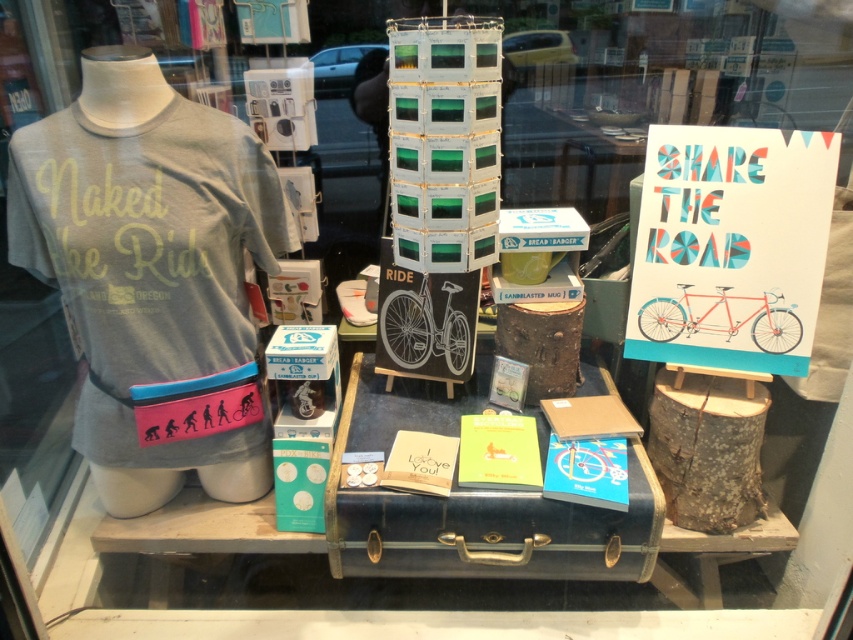
Question: Is white paper sign at upper right to the right of vintage leather suitcase at center from the viewer's perspective?

Choices:
 (A) no
 (B) yes

Answer: (B)

Question: Where is gray cotton t-shirt at left located in relation to vintage leather suitcase at center in the image?

Choices:
 (A) left
 (B) right

Answer: (A)

Question: Which of the following is the farthest from the observer?

Choices:
 (A) (376, 397)
 (B) (732, 128)

Answer: (A)

Question: Which object appears closest to the camera in this image?

Choices:
 (A) white paper sign at upper right
 (B) vintage leather suitcase at center
 (C) gray cotton t-shirt at left

Answer: (C)

Question: Among these objects, which one is nearest to the camera?

Choices:
 (A) vintage leather suitcase at center
 (B) gray cotton t-shirt at left

Answer: (B)

Question: Can you confirm if gray cotton t-shirt at left is positioned above vintage leather suitcase at center?

Choices:
 (A) yes
 (B) no

Answer: (A)